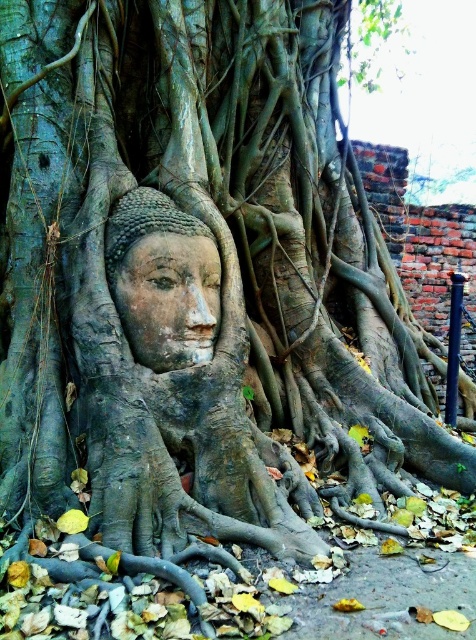
Question: Which point is farther to the camera?

Choices:
 (A) matte stone face at center
 (B) gray stone buddha head at center

Answer: (A)

Question: Which point is closer to the camera?

Choices:
 (A) matte stone face at center
 (B) gray stone buddha head at center

Answer: (B)

Question: Is gray stone buddha head at center above matte stone face at center?

Choices:
 (A) no
 (B) yes

Answer: (A)

Question: Does gray stone buddha head at center appear over matte stone face at center?

Choices:
 (A) no
 (B) yes

Answer: (A)

Question: Is gray stone buddha head at center smaller than matte stone face at center?

Choices:
 (A) yes
 (B) no

Answer: (B)